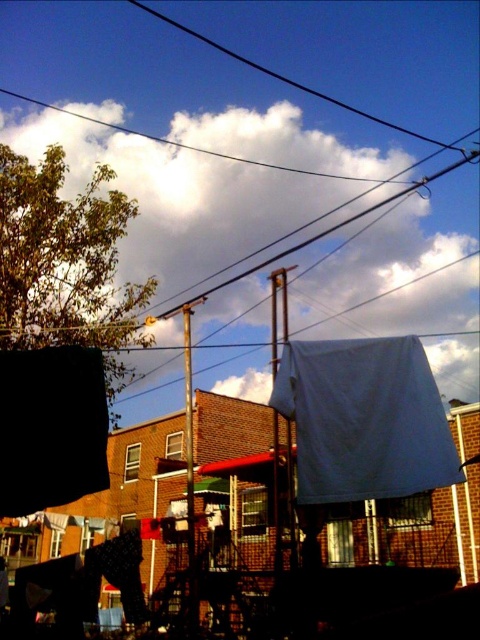
Is white fabric at center shorter than black matte canopy at lower left?

Incorrect, white fabric at center's height does not fall short of black matte canopy at lower left's.

Who is more forward, (x=410, y=426) or (x=51, y=490)?

Point (x=51, y=490)

I want to click on white fabric at center, so click(363, 419).

Which is below, black matte canopy at lower left or black wire at upper center?

black matte canopy at lower left

Which is more to the right, black matte canopy at lower left or black wire at upper center?

black wire at upper center

Which is behind, point (55, 346) or point (343, 100)?

Point (343, 100)

Where is `black matte canopy at lower left`? black matte canopy at lower left is located at coordinates (50, 428).

What do you see at coordinates (50, 428) in the screenshot?
I see `black matte canopy at lower left` at bounding box center [50, 428].

Is black matte canopy at lower left to the right of white fabric at upper center from the viewer's perspective?

Indeed, black matte canopy at lower left is positioned on the right side of white fabric at upper center.

What are the coordinates of `black matte canopy at lower left` in the screenshot? It's located at (50, 428).

This screenshot has height=640, width=480. Find the location of `black matte canopy at lower left`. black matte canopy at lower left is located at coordinates (50, 428).